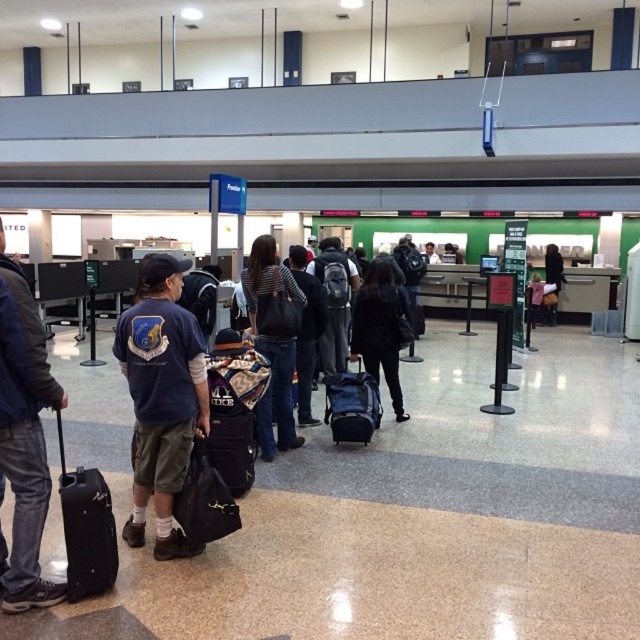
You are standing at the airport checkin area and see two points marked in the scene. The first point is at coordinate point(122, 362) and the second is at point(243, 472). Which point is closer to you?

Point(122, 362) is closer to you because it is in front of point(243, 472).

You are standing at the entrance of the airport checkin area. You see a point marked at coordinate (x=161, y=397). What is located at that point?

The point at coordinate (x=161, y=397) has the navy blue shirt at center located there.

In the scene shown: You are an airport staff member observing the checkin area. You need to determine if the navy blue shirt at center can see the black matte backpack at center over the heads of other passengers. Based on their relative heights, what do you think?

The navy blue shirt at center is much taller than the black matte backpack at center, so the navy blue shirt at center would likely be able to see over the heads of other passengers to spot the black matte backpack at center.